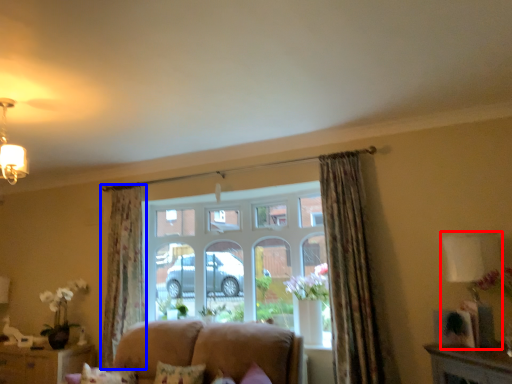
Question: Among these objects, which one is farthest to the camera, lamp (highlighted by a red box) or curtain (highlighted by a blue box)?

Choices:
 (A) lamp
 (B) curtain

Answer: (B)